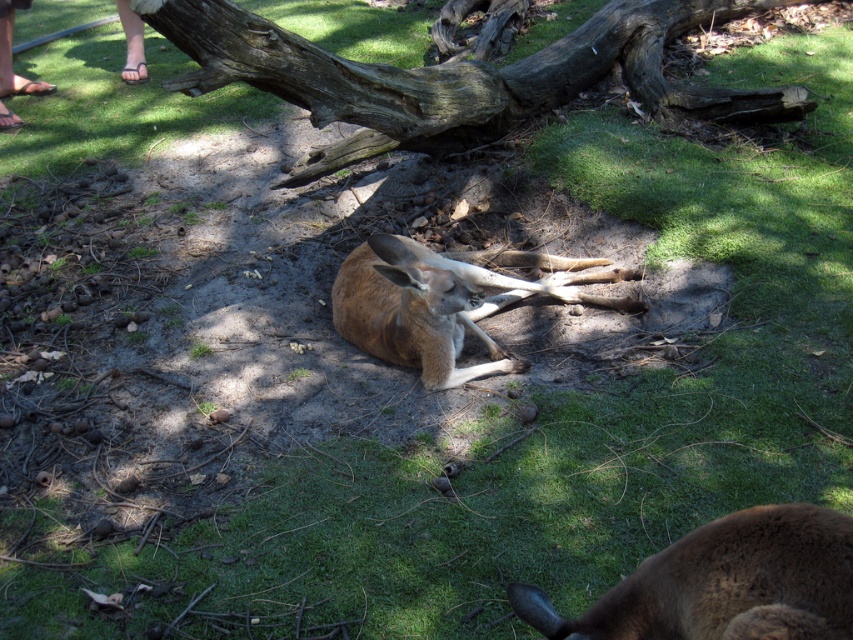
Question: Does dark brown wood at upper center have a larger size compared to brown furry kangaroo at center?

Choices:
 (A) yes
 (B) no

Answer: (A)

Question: Based on their relative distances, which object is nearer to the brown furry kangaroo at lower right?

Choices:
 (A) dark brown wood at upper center
 (B) brown furry kangaroo at center

Answer: (B)

Question: Which of the following is the closest to the observer?

Choices:
 (A) dark brown wood at upper center
 (B) brown furry kangaroo at center
 (C) brown furry kangaroo at lower right

Answer: (C)

Question: Among these points, which one is farthest from the camera?

Choices:
 (A) (361, 120)
 (B) (809, 512)
 (C) (421, 272)

Answer: (A)

Question: From the image, what is the correct spatial relationship of dark brown wood at upper center in relation to brown furry kangaroo at lower right?

Choices:
 (A) right
 (B) left

Answer: (A)

Question: Does dark brown wood at upper center have a greater width compared to brown furry kangaroo at center?

Choices:
 (A) no
 (B) yes

Answer: (B)